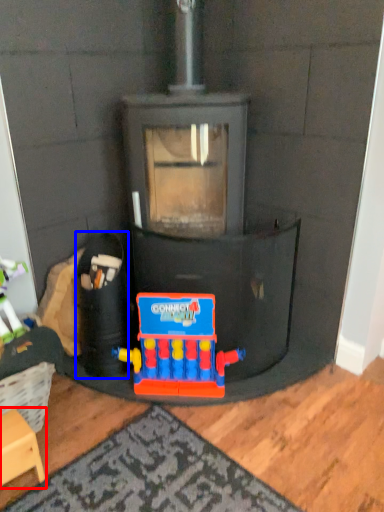
Question: Which object is closer to the camera taking this photo, furniture (highlighted by a red box) or toy (highlighted by a blue box)?

Choices:
 (A) furniture
 (B) toy

Answer: (A)